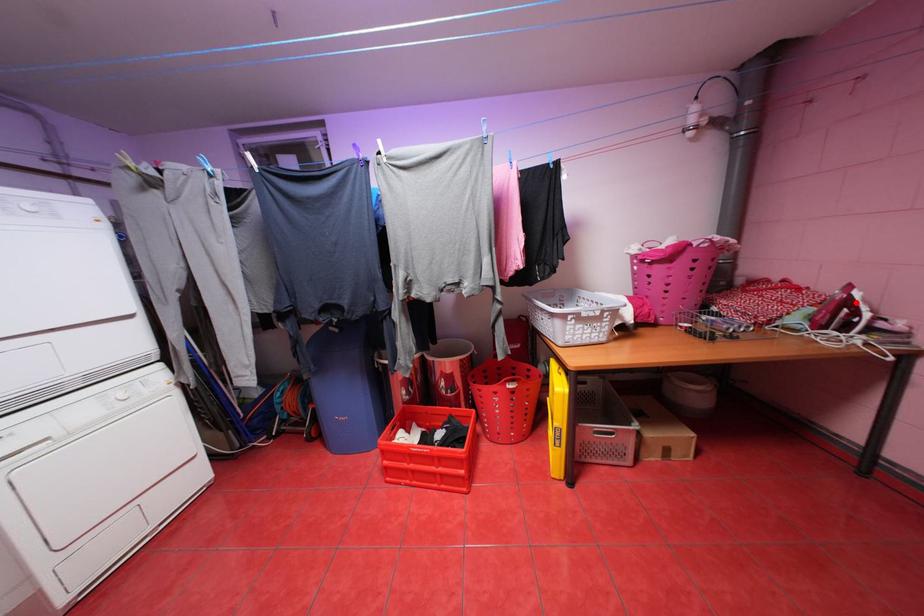
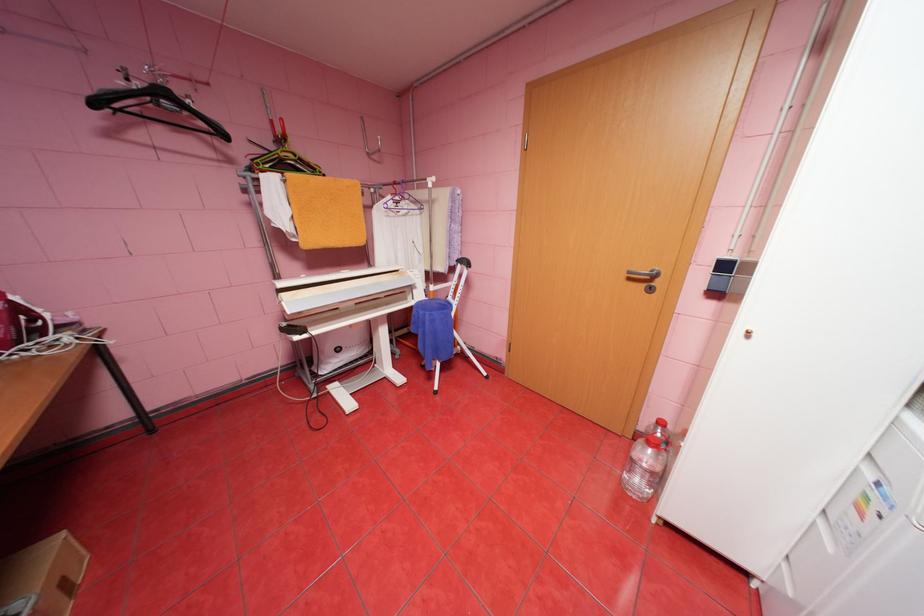
Question: I am providing you with two images of the same scene from different viewpoints. Given a red point in image1, look at the same physical point in image2. Is it:

Choices:
 (A) Closer to the viewpoint
 (B) Farther from the viewpoint

Answer: (B)